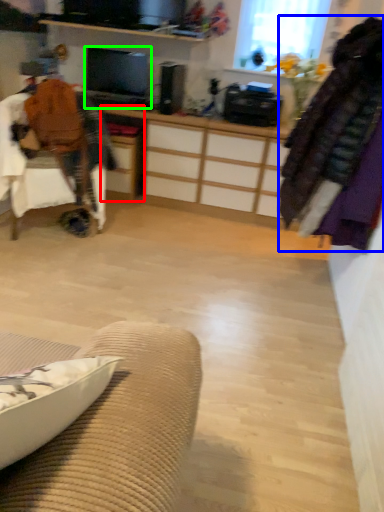
Question: Estimate the real-world distances between objects in this image. Which object is closer to desk (highlighted by a red box), clothing (highlighted by a blue box) or television (highlighted by a green box)?

Choices:
 (A) clothing
 (B) television

Answer: (B)